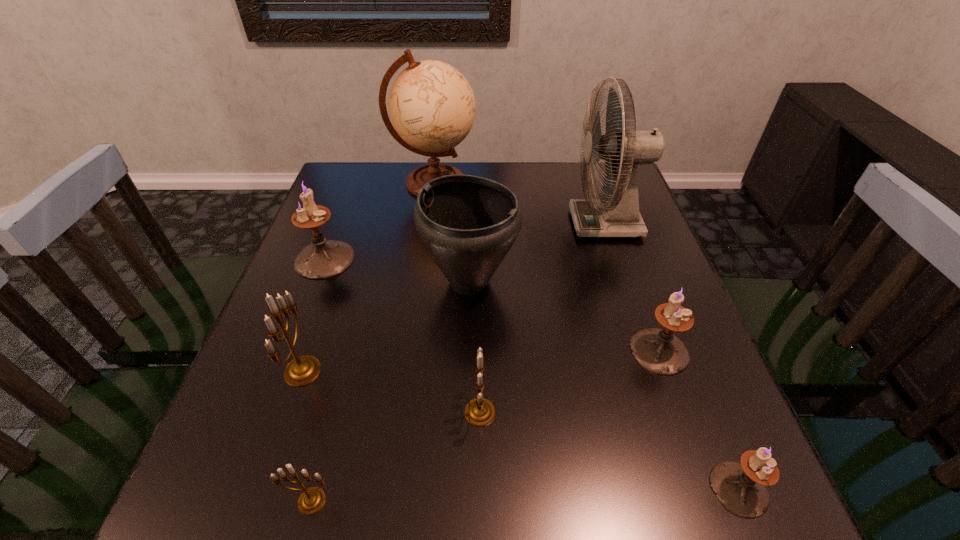
Where is `vacant space located 0.360m on the left of the rightmost gold candelabrum`? vacant space located 0.360m on the left of the rightmost gold candelabrum is located at coordinates (258, 412).

This screenshot has height=540, width=960. In order to click on vacant space located on the right of the second gold candelabrum from left to right in this screenshot , I will do `click(489, 501)`.

I want to click on free location located 0.260m on the back of the nearest purple candle holder, so click(x=676, y=334).

You are a GUI agent. You are given a task and a screenshot of the screen. Output one action in this format:
    pyautogui.click(x=<x>, y=<y>)
    Task: Click on the globe that is positioned at the far edge
    The image size is (960, 540).
    Given the screenshot: What is the action you would take?
    pyautogui.click(x=432, y=107)

Locate an element on the screen. fan present at the far edge is located at coordinates (x=619, y=216).

At what (x,y) coordinates should I click in order to perform the action: click on fan located in the right edge section of the desktop. Please return your answer as a coordinate pair (x, y). Image resolution: width=960 pixels, height=540 pixels. Looking at the image, I should click on (619, 216).

Identify the location of object at the near left corner. This screenshot has width=960, height=540. (312, 499).

You are a GUI agent. You are given a task and a screenshot of the screen. Output one action in this format:
    pyautogui.click(x=<x>, y=<y>)
    Task: Click on the object present at the far right corner
    
    Given the screenshot: What is the action you would take?
    click(619, 216)

At what (x,y) coordinates should I click in order to perform the action: click on object present at the near right corner. Please return your answer as a coordinate pair (x, y). The height and width of the screenshot is (540, 960). Looking at the image, I should click on pos(740,487).

The image size is (960, 540). I want to click on vacant space at the near edge of the desktop, so click(x=632, y=496).